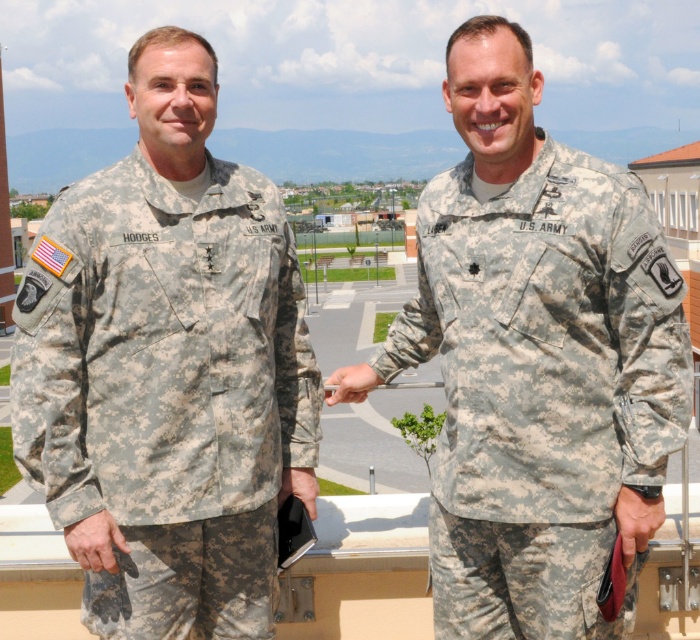
Is camouflage fabric uniform at left above camouflage fabric uniform at right?

No, camouflage fabric uniform at left is not above camouflage fabric uniform at right.

Is point (288, 440) behind point (662, 326)?

Yes, it is.

Find the location of a particular element. Image resolution: width=700 pixels, height=640 pixels. camouflage fabric uniform at left is located at coordinates (168, 392).